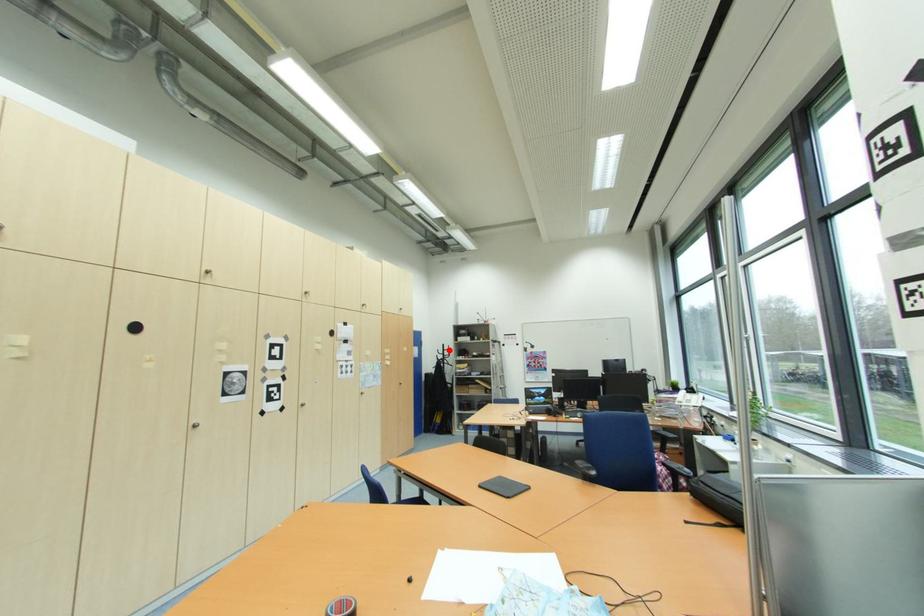
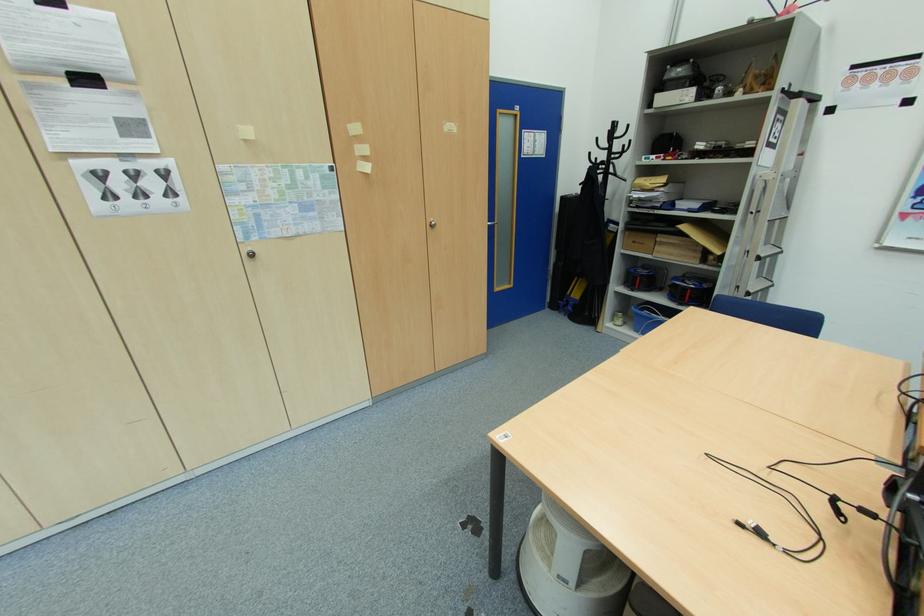
Locate, in the second image, the point that corresponds to the highlighted location in the first image.

(619, 136)